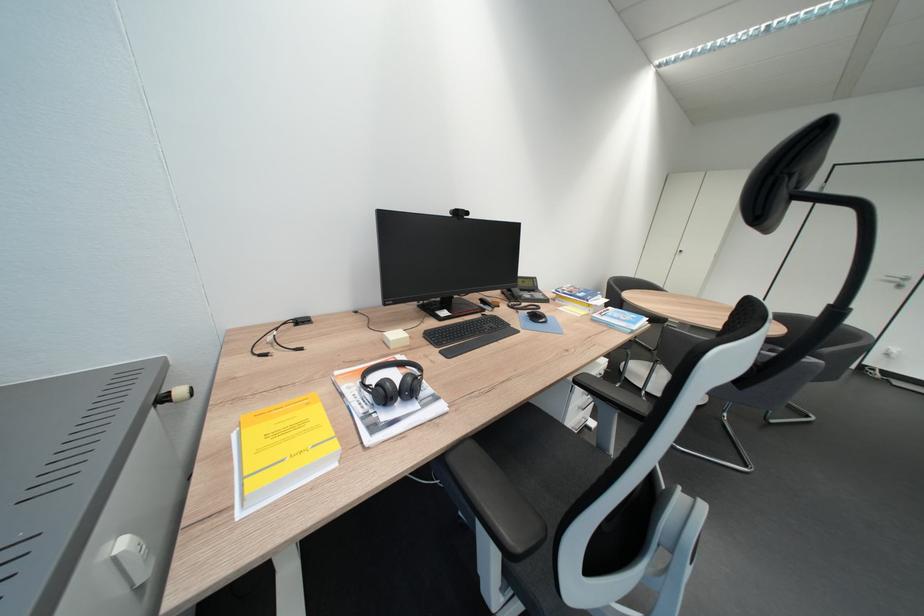
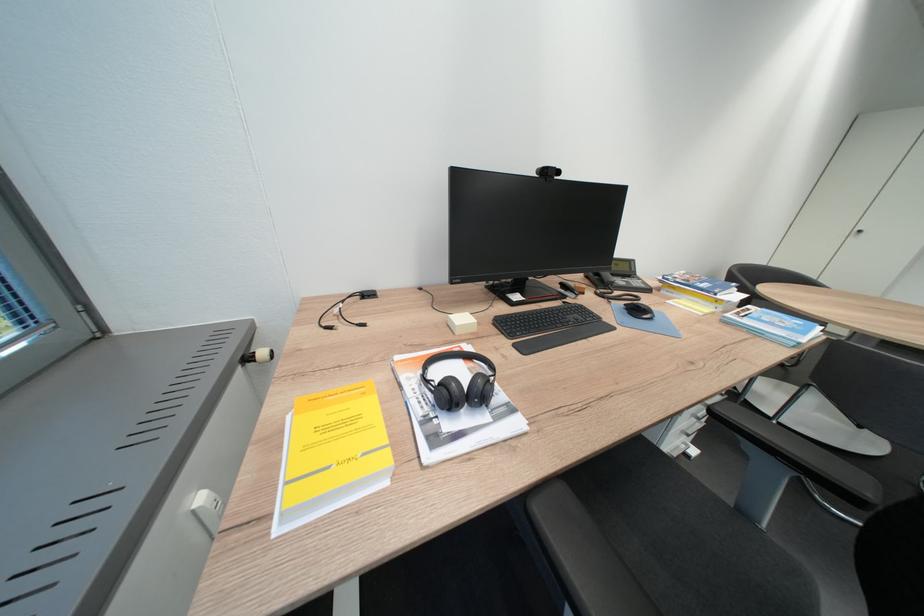
Find the pixel in the second image that matches (548,318) in the first image.

(650, 313)